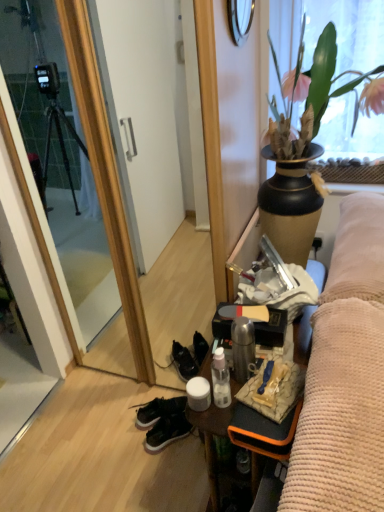
Question: Can you confirm if matte black vase with plant at upper right is taller than black leather sneakers at lower center?

Choices:
 (A) yes
 (B) no

Answer: (A)

Question: Is matte black vase with plant at upper right positioned with its back to black leather sneakers at lower center?

Choices:
 (A) no
 (B) yes

Answer: (A)

Question: From a real-world perspective, is matte black vase with plant at upper right located higher than black leather sneakers at lower center?

Choices:
 (A) no
 (B) yes

Answer: (B)

Question: Is matte black vase with plant at upper right thinner than black leather sneakers at lower center?

Choices:
 (A) no
 (B) yes

Answer: (A)

Question: Is matte black vase with plant at upper right positioned beyond the bounds of black leather sneakers at lower center?

Choices:
 (A) no
 (B) yes

Answer: (B)

Question: From the image's perspective, is black suede sneakers at lower center above or below metallic circular mirror at upper center?

Choices:
 (A) above
 (B) below

Answer: (B)

Question: Is black suede sneakers at lower center spatially inside metallic circular mirror at upper center, or outside of it?

Choices:
 (A) inside
 (B) outside

Answer: (B)

Question: From a real-world perspective, is black suede sneakers at lower center above or below metallic circular mirror at upper center?

Choices:
 (A) above
 (B) below

Answer: (B)

Question: Relative to metallic circular mirror at upper center, is black suede sneakers at lower center in front or behind?

Choices:
 (A) front
 (B) behind

Answer: (B)

Question: Considering their positions, is metallic silver desk at center located in front of or behind metallic circular mirror at upper center?

Choices:
 (A) front
 (B) behind

Answer: (A)

Question: From the image's perspective, is metallic silver desk at center above or below metallic circular mirror at upper center?

Choices:
 (A) above
 (B) below

Answer: (B)

Question: In terms of height, does metallic silver desk at center look taller or shorter compared to metallic circular mirror at upper center?

Choices:
 (A) short
 (B) tall

Answer: (B)

Question: From a real-world perspective, is metallic silver desk at center physically located above or below metallic circular mirror at upper center?

Choices:
 (A) above
 (B) below

Answer: (B)

Question: From their relative heights in the image, would you say metallic circular mirror at upper center is taller or shorter than black leather sneakers at lower center?

Choices:
 (A) tall
 (B) short

Answer: (A)

Question: From a real-world perspective, is metallic circular mirror at upper center positioned above or below black leather sneakers at lower center?

Choices:
 (A) below
 (B) above

Answer: (B)